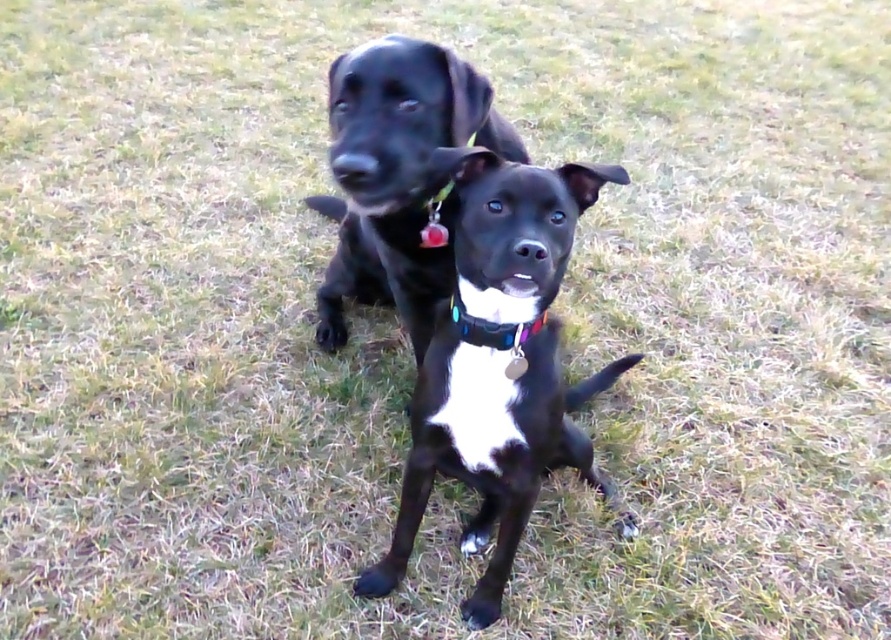
You are a photographer trying to capture both the black shiny dog at center and the multicolored fabric neckband at center in a single frame. Based on their positions, which object should you focus on first to ensure both are in focus?

The black shiny dog at center is located below the multicolored fabric neckband at center. To ensure both are in focus, you should focus on the multicolored fabric neckband at center first since it is higher up and closer to the background, allowing the depth of field to cover the dog below.

You are a photographer trying to capture both dogs in the scene. Since you want to focus on the black shiny dog at center and the shiny black dog at center, which one should you position to the right to frame them properly?

The black shiny dog at center is already positioned to the right of the shiny black dog at center, so you should keep the black shiny dog at center on the right side to frame them properly.